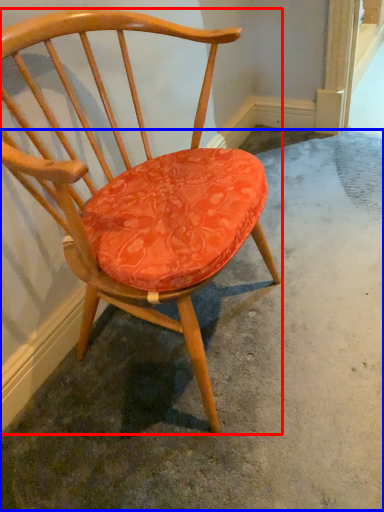
Question: Which object appears closest to the camera in this image, chair (highlighted by a red box) or concrete (highlighted by a blue box)?

Choices:
 (A) chair
 (B) concrete

Answer: (A)